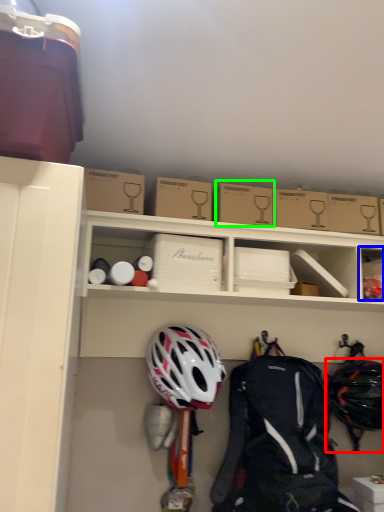
Question: Which object is the closest to the helmet (highlighted by a red box)? Choose among these: storage box (highlighted by a blue box) or cardboard box (highlighted by a green box).

Choices:
 (A) storage box
 (B) cardboard box

Answer: (A)